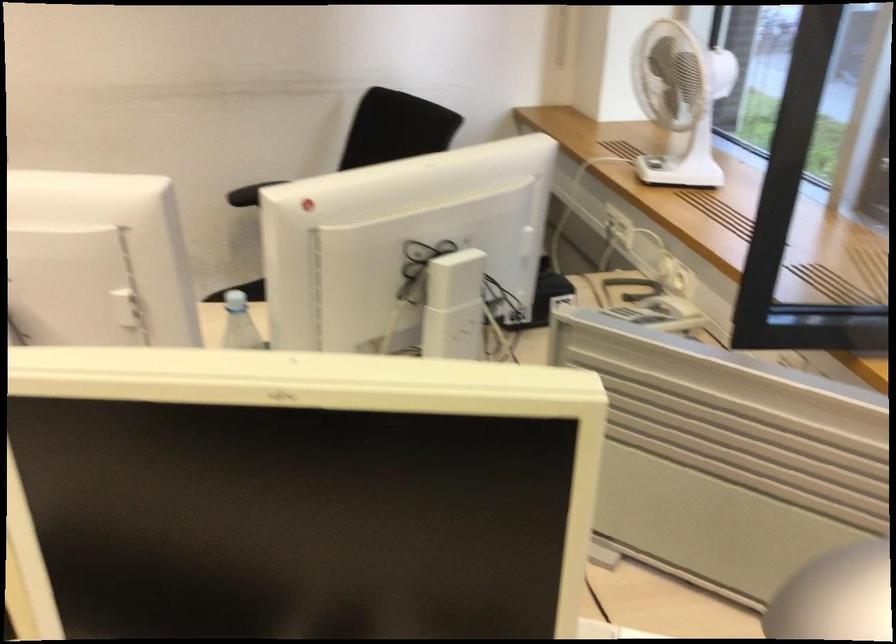
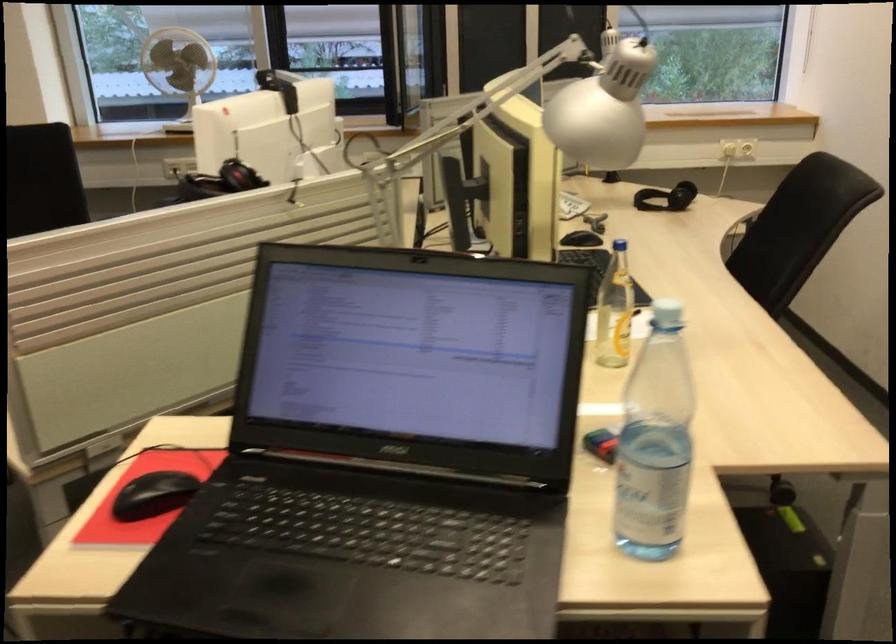
Where in the second image is the point corresponding to pixel 669 77 from the first image?

(177, 67)